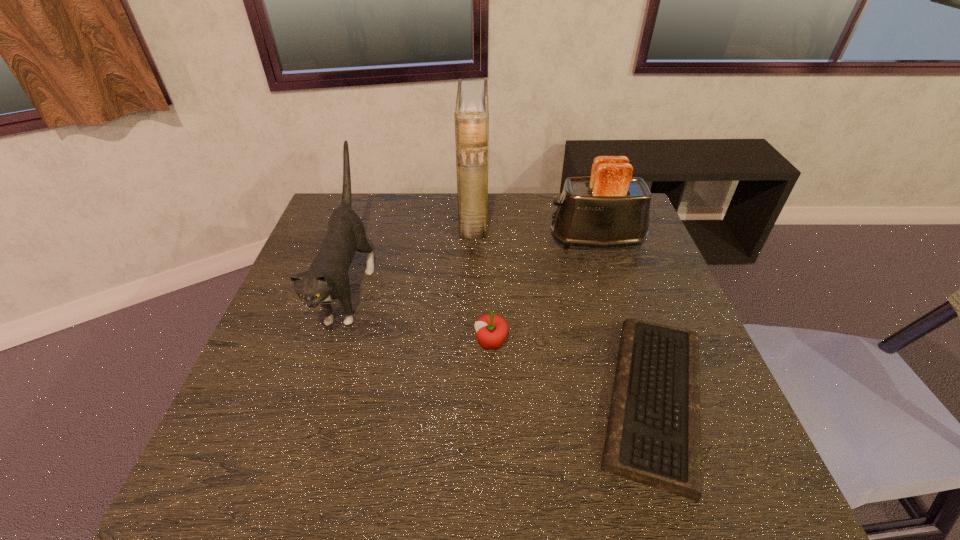
Identify the location of phonebook. The image size is (960, 540). (471, 114).

Locate an element on the screen. The image size is (960, 540). cat is located at coordinates (327, 279).

The height and width of the screenshot is (540, 960). Identify the location of the fourth shortest object. pyautogui.click(x=327, y=279).

The image size is (960, 540). Find the location of `the third shortest object`. the third shortest object is located at coordinates (610, 208).

What are the coordinates of `apple` in the screenshot? It's located at (492, 329).

Where is `computer keyboard`? computer keyboard is located at coordinates (653, 437).

Where is `vacant region located 0.230m on the cover of the phonebook`? The width and height of the screenshot is (960, 540). vacant region located 0.230m on the cover of the phonebook is located at coordinates pos(560,217).

Where is `vacant position located 0.230m at the face of the leftmost object`? vacant position located 0.230m at the face of the leftmost object is located at coordinates (296, 459).

This screenshot has height=540, width=960. Identify the location of free space located 0.320m on the side of the third shortest object with the control lever. (441, 240).

In order to click on free region located 0.270m on the side of the third shortest object with the control lever in this screenshot , I will do click(458, 240).